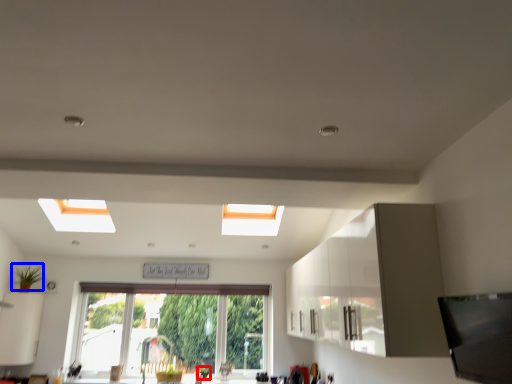
Question: Which point is further to the camera, plant (highlighted by a red box) or plant (highlighted by a blue box)?

Choices:
 (A) plant
 (B) plant

Answer: (A)